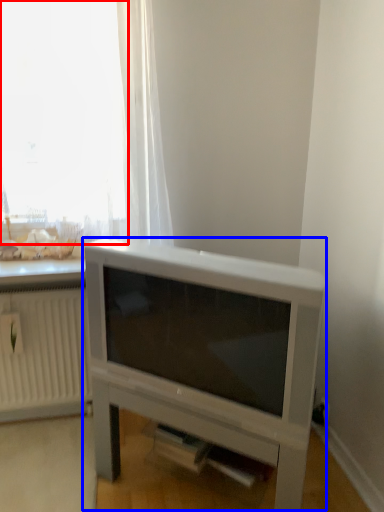
Question: Which point is further to the camera, window (highlighted by a red box) or entertainment center (highlighted by a blue box)?

Choices:
 (A) window
 (B) entertainment center

Answer: (A)